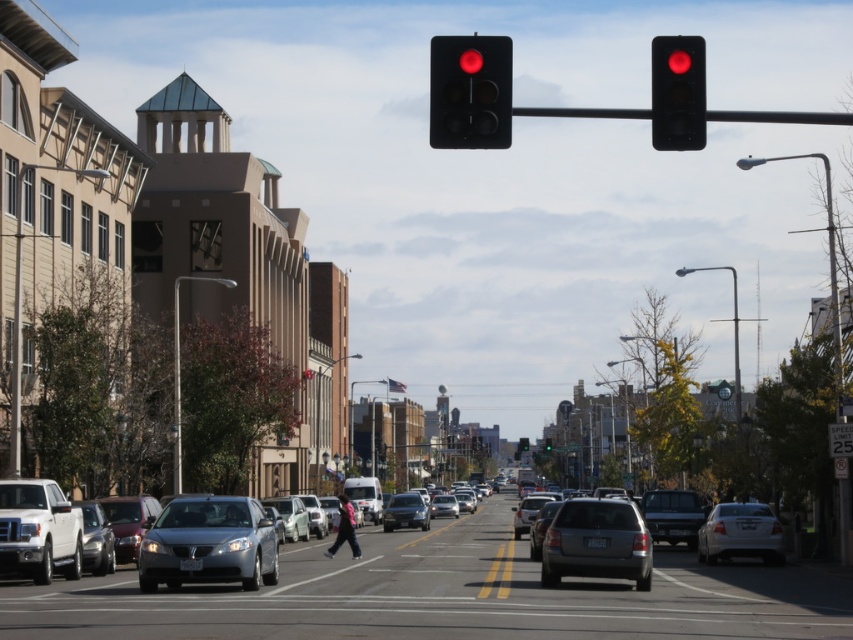
Question: Is metallic silver sedan at center to the right of silver metallic sedan at lower left from the viewer's perspective?

Choices:
 (A) no
 (B) yes

Answer: (B)

Question: Does metallic silver sedan at center appear on the right side of silver metallic suv at center?

Choices:
 (A) yes
 (B) no

Answer: (B)

Question: Can you confirm if matte black truck at center is smaller than green glass traffic light at center?

Choices:
 (A) no
 (B) yes

Answer: (B)

Question: Which of the following is the closest to the observer?

Choices:
 (A) (114, 560)
 (B) (525, 436)
 (C) (399, 520)

Answer: (A)

Question: Among these points, which one is farthest from the camera?

Choices:
 (A) (483, 88)
 (B) (675, 72)
 (C) (573, 634)

Answer: (C)

Question: Which object appears farthest from the camera in this image?

Choices:
 (A) white matte sedan at lower right
 (B) metallic silver sedan at center

Answer: (A)